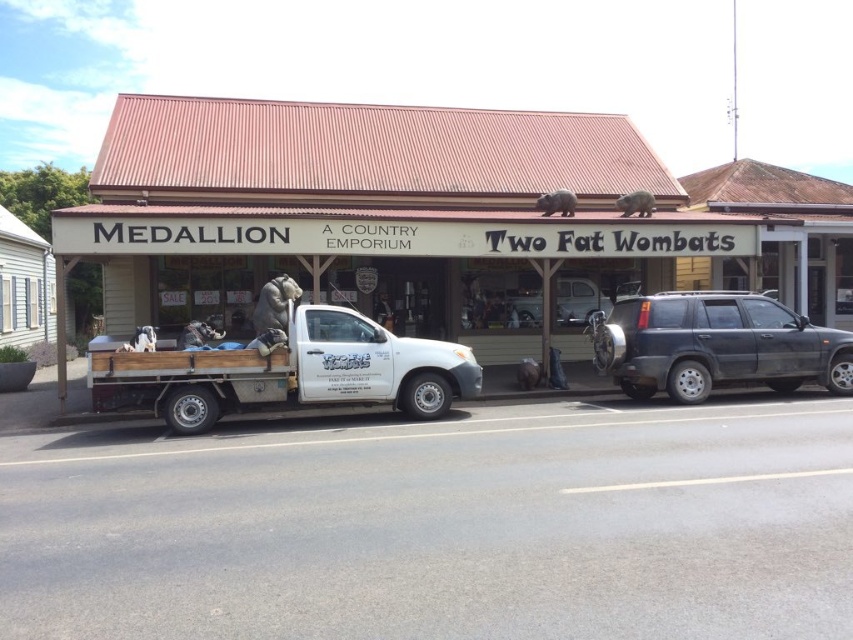
Question: Is white matte truck at center below satin silver truck at center?

Choices:
 (A) no
 (B) yes

Answer: (B)

Question: Which of the following is the closest to the observer?

Choices:
 (A) satin silver truck at center
 (B) white matte truck at lower left

Answer: (A)

Question: Which object is positioned farthest from the white matte truck at lower left?

Choices:
 (A) satin silver truck at center
 (B) white matte truck at center

Answer: (B)

Question: Which point is closer to the camera taking this photo?

Choices:
 (A) (556, 145)
 (B) (840, 381)

Answer: (B)

Question: Can you confirm if white matte truck at lower left is positioned to the right of satin silver truck at center?

Choices:
 (A) yes
 (B) no

Answer: (B)

Question: Can you confirm if white matte truck at center is bigger than satin silver truck at center?

Choices:
 (A) yes
 (B) no

Answer: (A)